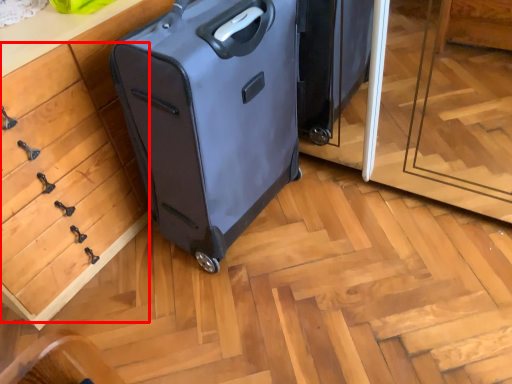
Question: From the image's perspective, what is the correct spatial positioning of drawer (annotated by the red box) in reference to suitcase?

Choices:
 (A) below
 (B) above

Answer: (A)